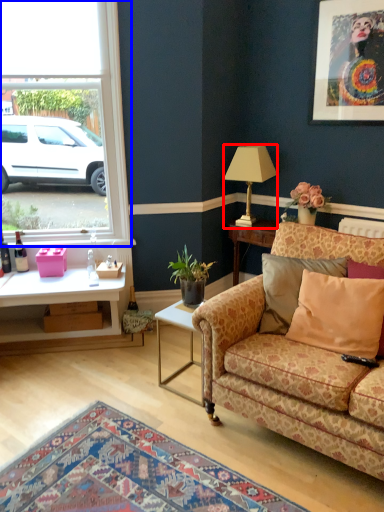
Question: Among these objects, which one is farthest to the camera, lamp (highlighted by a red box) or window (highlighted by a blue box)?

Choices:
 (A) lamp
 (B) window

Answer: (A)